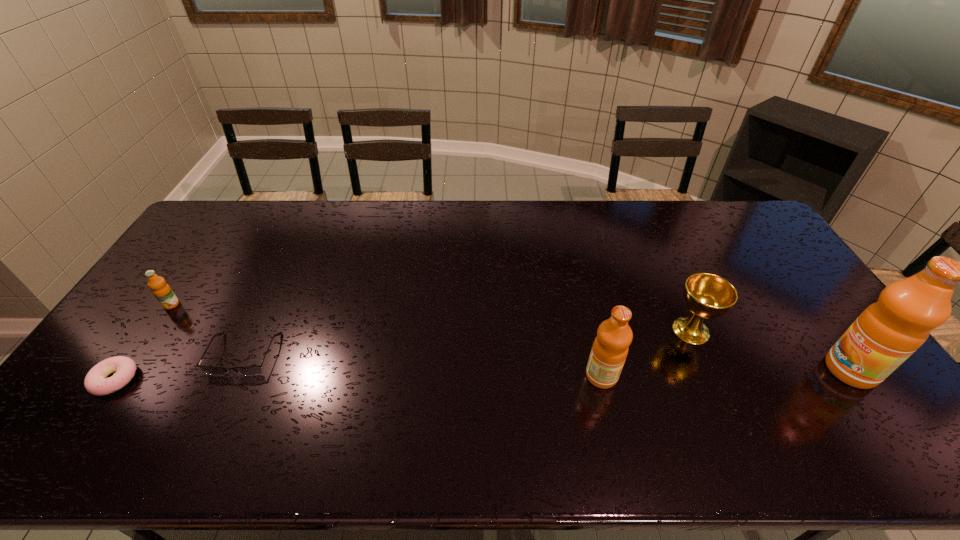
At what (x,y) coordinates should I click in order to perform the action: click on free space that satisfies the following two spatial constraints: 1. on the label of the farthest object; 2. on the right side of the chalice. Please return your answer as a coordinate pair (x, y). Looking at the image, I should click on (154, 330).

In order to click on vacant space that satisfies the following two spatial constraints: 1. on the label of the third shortest object; 2. on the right side of the chalice in this screenshot , I will do `click(154, 330)`.

You are a GUI agent. You are given a task and a screenshot of the screen. Output one action in this format:
    pyautogui.click(x=<x>, y=<y>)
    Task: Click on the free space that satisfies the following two spatial constraints: 1. on the front side of the third tallest object; 2. on the label side of the fourth object from left to right
    The width and height of the screenshot is (960, 540).
    Given the screenshot: What is the action you would take?
    pyautogui.click(x=711, y=376)